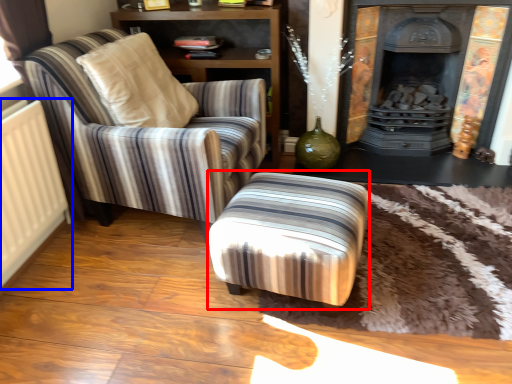
Question: Which point is closer to the camera, stool (highlighted by a red box) or radiator (highlighted by a blue box)?

Choices:
 (A) stool
 (B) radiator

Answer: (B)